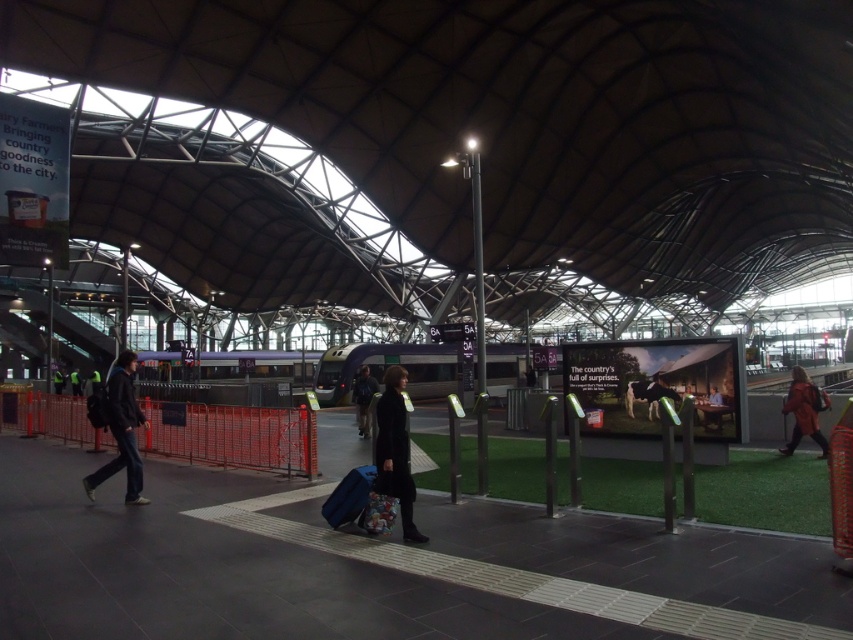
Question: Does silver metallic train at center appear under dark blue jeans at lower left?

Choices:
 (A) no
 (B) yes

Answer: (B)

Question: Does orange leather jacket at right come behind reflective silver helmet at center?

Choices:
 (A) no
 (B) yes

Answer: (A)

Question: Estimate the real-world distances between objects in this image. Which object is farther from the dark blue jeans at lower left?

Choices:
 (A) dark matte coat at center
 (B) silver metallic train at center
 (C) reflective silver helmet at center
 (D) dark blue jacket at left

Answer: (C)

Question: Which point is closer to the camera taking this photo?

Choices:
 (A) (376, 385)
 (B) (90, 481)
 (C) (498, 372)
 (D) (57, 385)

Answer: (B)

Question: Estimate the real-world distances between objects in this image. Which object is closer to the orange leather jacket at right?

Choices:
 (A) dark blue jacket at left
 (B) dark matte coat at center

Answer: (B)

Question: Does dark matte coat at center have a lesser width compared to dark blue jeans at lower left?

Choices:
 (A) yes
 (B) no

Answer: (A)